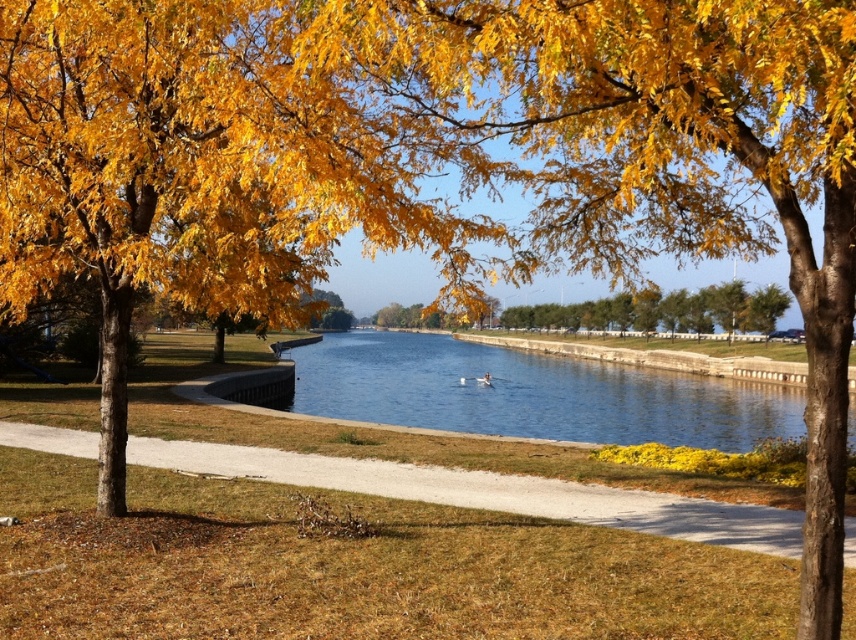
Question: Which of the following is the closest to the observer?

Choices:
 (A) yellow leafy tree at center
 (B) gravel path at center

Answer: (A)

Question: Which object is closer to the camera taking this photo?

Choices:
 (A) blue smooth water at center
 (B) gravel path at center

Answer: (B)

Question: Can you confirm if blue smooth water at center is smaller than yellow leafy tree at center?

Choices:
 (A) yes
 (B) no

Answer: (A)

Question: Which object is the farthest from the gravel path at center?

Choices:
 (A) blue smooth water at center
 (B) yellow leafy tree at center

Answer: (A)

Question: Can you confirm if blue smooth water at center is positioned above gravel path at center?

Choices:
 (A) no
 (B) yes

Answer: (B)

Question: Is blue smooth water at center behind gravel path at center?

Choices:
 (A) no
 (B) yes

Answer: (B)